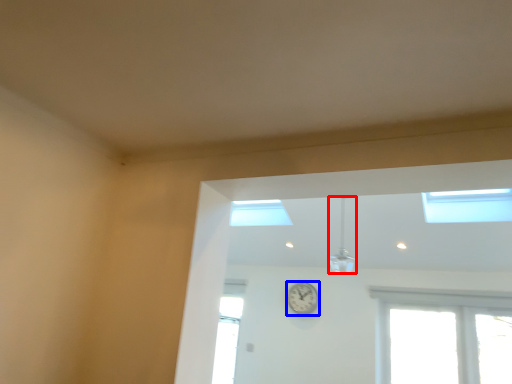
Question: Which object is closer to the camera taking this photo, light fixture (highlighted by a red box) or clock (highlighted by a blue box)?

Choices:
 (A) light fixture
 (B) clock

Answer: (A)